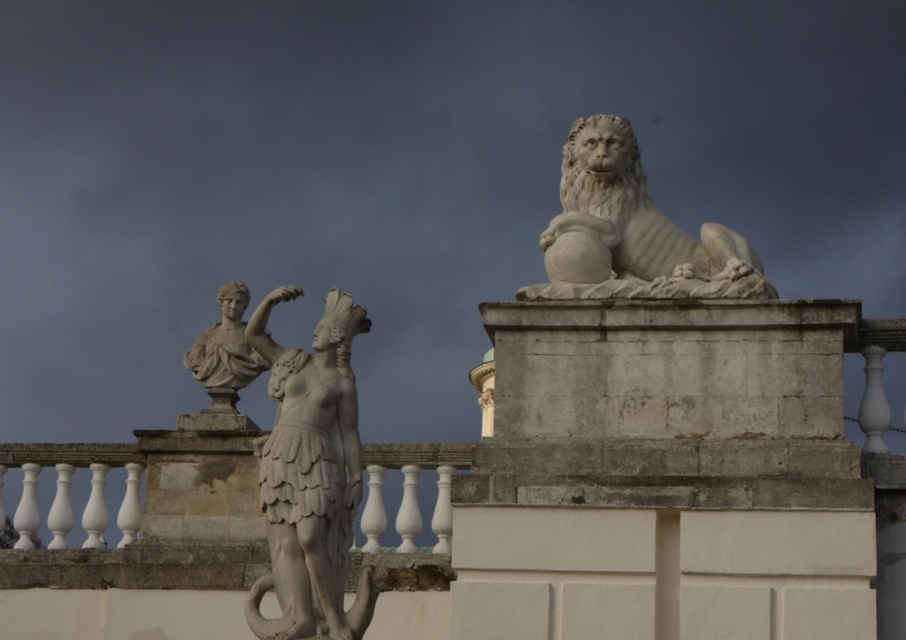
Question: Is white stone statue at center to the left of white stone lion at upper right from the viewer's perspective?

Choices:
 (A) yes
 (B) no

Answer: (A)

Question: Which of the following is the farthest from the observer?

Choices:
 (A) (660, 284)
 (B) (363, 310)

Answer: (A)

Question: Which point is closer to the camera taking this photo?

Choices:
 (A) (583, 129)
 (B) (336, 520)

Answer: (B)

Question: Does white stone statue at center have a greater width compared to white stone lion at upper right?

Choices:
 (A) no
 (B) yes

Answer: (A)

Question: Is white stone statue at center below white stone lion at upper right?

Choices:
 (A) yes
 (B) no

Answer: (A)

Question: Which point is closer to the camera taking this photo?

Choices:
 (A) pyautogui.click(x=309, y=483)
 (B) pyautogui.click(x=633, y=236)

Answer: (A)